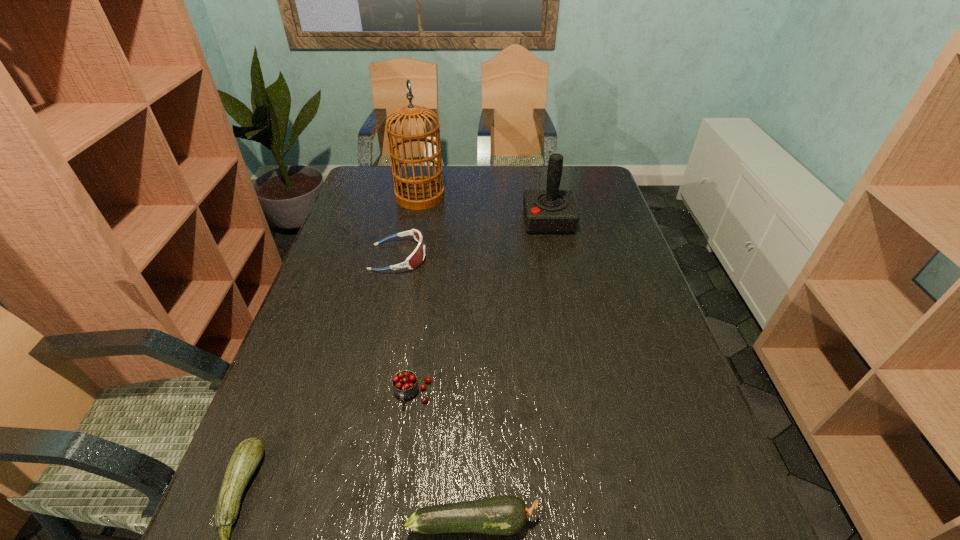
The width and height of the screenshot is (960, 540). Find the location of `birdcage`. birdcage is located at coordinates (421, 192).

Identify the location of joystick. (552, 211).

At what (x,y) coordinates should I click in order to perform the action: click on the rightmost object. Please return your answer as a coordinate pair (x, y). This screenshot has height=540, width=960. Looking at the image, I should click on (552, 211).

Image resolution: width=960 pixels, height=540 pixels. I want to click on cherry, so click(405, 385).

Where is `the fourth farthest object`? The height and width of the screenshot is (540, 960). the fourth farthest object is located at coordinates (405, 385).

You are a GUI agent. You are given a task and a screenshot of the screen. Output one action in this format:
    pyautogui.click(x=<x>, y=<y>)
    Task: Click on the third farthest object
    
    Given the screenshot: What is the action you would take?
    pyautogui.click(x=416, y=258)

Where is `free space located on the front of the tallest object`? This screenshot has height=540, width=960. free space located on the front of the tallest object is located at coordinates (414, 231).

Locate an element on the screen. This screenshot has height=540, width=960. vacant space located 0.080m on the base of the second tallest object is located at coordinates (500, 221).

Locate an element on the screen. This screenshot has width=960, height=540. vacant space situated 0.100m on the base of the second tallest object is located at coordinates (494, 221).

Find the location of a particular element. vacant space located 0.210m on the base of the second tallest object is located at coordinates (461, 221).